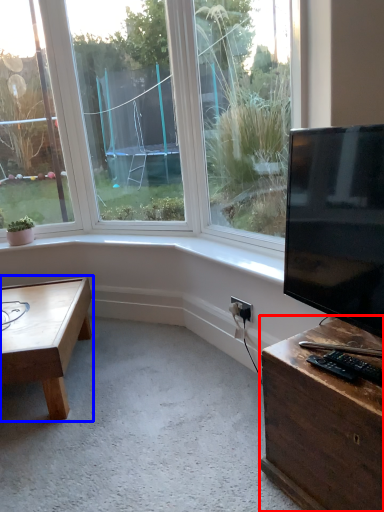
Question: Which of the following is the farthest to the observer, desk (highlighted by a red box) or coffee table (highlighted by a blue box)?

Choices:
 (A) desk
 (B) coffee table

Answer: (B)